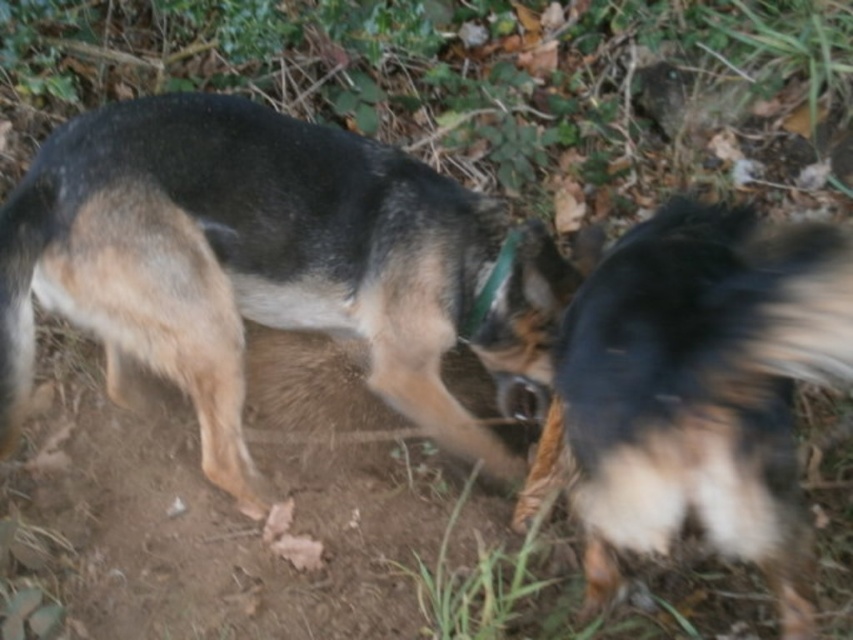
Based on the photo, you are a dog trainer observing two dogs in a park. You notice a black fur dog at center and a black fur tail at right. Can you determine if the distance between them is sufficient for a training exercise that requires at least 2 feet of separation?

The black fur dog at center is 26.60 inches from the black fur tail at right. Since 26.60 inches is approximately 2.22 feet, which exceeds the required 2 feet of separation, the distance is sufficient for the training exercise.

You are a dog trainer observing two dogs in a park. You notice a black fur dog at center and a black fur tail at right. Which dog is closer to you?

The black fur dog at center is closer to you because it is positioned over the black fur tail at right, indicating it is in front.